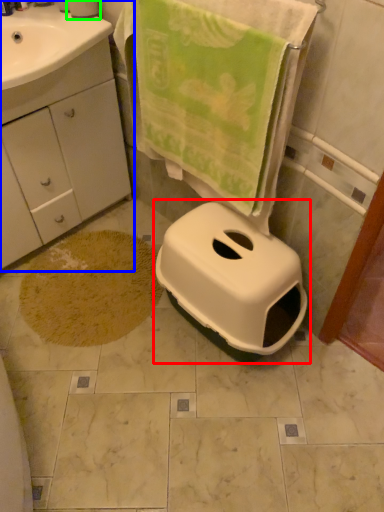
Question: Which object is positioned farthest from toilet (highlighted by a red box)? Select from bathroom cabinet (highlighted by a blue box) and toilet paper (highlighted by a green box).

Choices:
 (A) bathroom cabinet
 (B) toilet paper

Answer: (B)